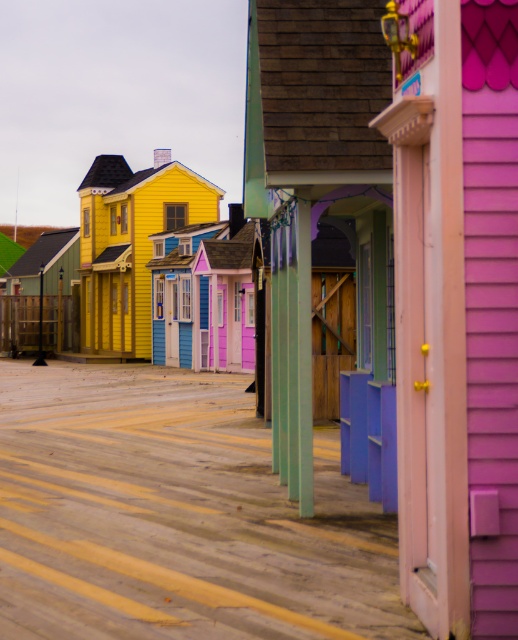
You are a delivery person carrying a package that requires a clear path of at least 4 meters to reach the matte yellow house at center. You notice the wooden fence at left nearby. Can you safely deliver the package without needing to adjust your path?

The matte yellow house at center is 4.18 meters from the wooden fence at left, which is just over the required 4 meters. Therefore, you can safely deliver the package without needing to adjust your path.

You are standing on the boardwalk and want to take a photo of the pink matte door at center and the wooden fence at left. Which object will appear larger in your photo?

The pink matte door at center will appear larger in the photo because it is closer to the viewer than the wooden fence at left.